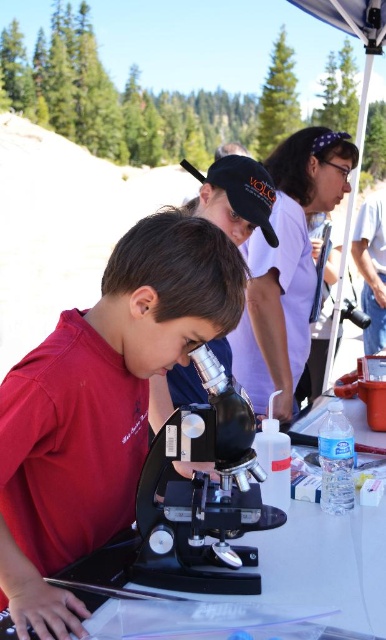
Is point (23, 458) farther from viewer compared to point (301, 289)?

No, it is not.

Can you confirm if matte black microscope at center is thinner than matte purple shirt at upper center?

Indeed, matte black microscope at center has a lesser width compared to matte purple shirt at upper center.

Image resolution: width=386 pixels, height=640 pixels. Identify the location of matte black microscope at center. (101, 406).

What do you see at coordinates (203, 493) in the screenshot? The height and width of the screenshot is (640, 386). I see `black metallic microscope at center` at bounding box center [203, 493].

This screenshot has height=640, width=386. Find the location of `black metallic microscope at center`. black metallic microscope at center is located at coordinates (203, 493).

Between matte black microscope at center and black metallic microscope at center, which one is positioned higher?

Positioned higher is matte black microscope at center.

Can you confirm if matte black microscope at center is positioned to the right of black metallic microscope at center?

No, matte black microscope at center is not to the right of black metallic microscope at center.

Is point (49, 428) positioned behind point (218, 570)?

No, (49, 428) is in front of (218, 570).

Where is `matte black microscope at center`? Image resolution: width=386 pixels, height=640 pixels. matte black microscope at center is located at coordinates (101, 406).